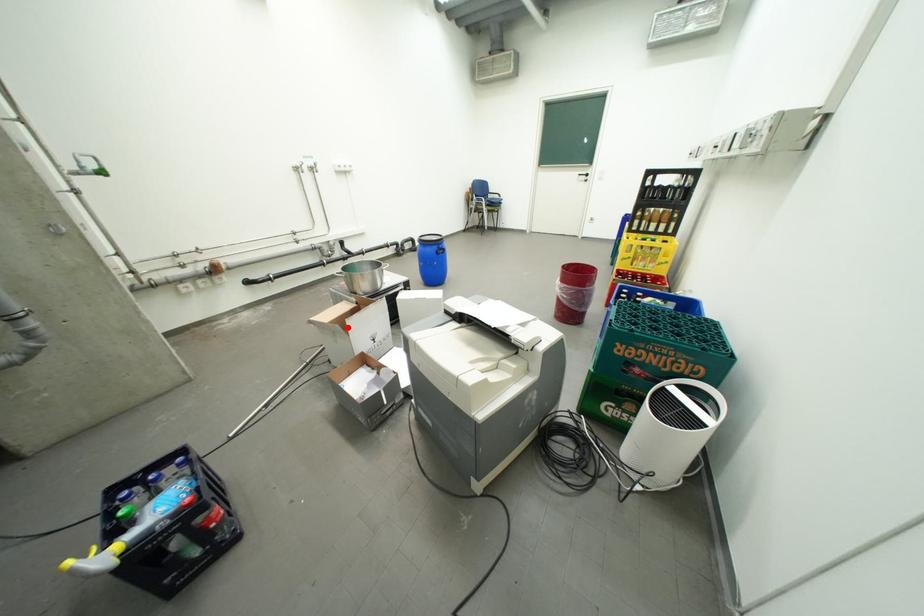
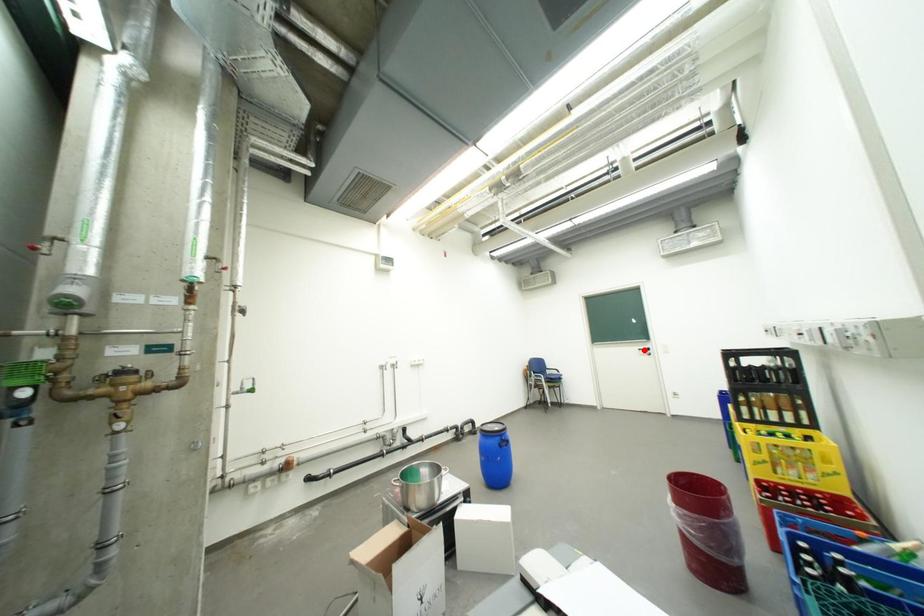
I am providing you with two images of the same scene from different viewpoints. A red point is marked on the first image and another point is marked on the second image. Are the points marked in image1 and image2 representing the same 3D position?

No